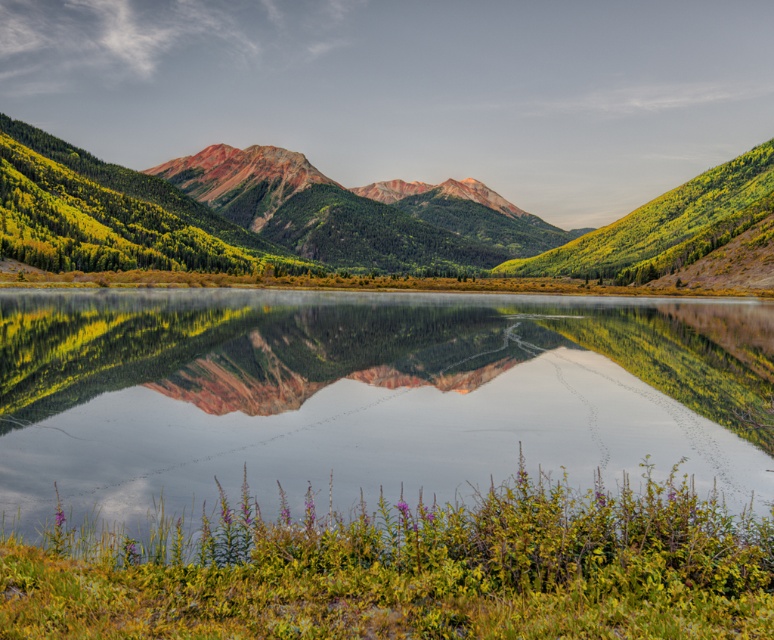
Question: Among these objects, which one is nearest to the camera?

Choices:
 (A) green grassy shore at lower center
 (B) matte red rock mountain range at center

Answer: (A)

Question: Does green grassy shore at lower center appear on the right side of matte red rock mountain range at center?

Choices:
 (A) yes
 (B) no

Answer: (B)

Question: Which point appears farthest from the camera in this image?

Choices:
 (A) (173, 259)
 (B) (165, 403)

Answer: (A)

Question: Which object appears farthest from the camera in this image?

Choices:
 (A) matte red rock mountain range at center
 (B) green grassy shore at lower center

Answer: (A)

Question: Does green grassy shore at lower center come in front of matte red rock mountain range at center?

Choices:
 (A) yes
 (B) no

Answer: (A)

Question: Is green grassy shore at lower center behind matte red rock mountain range at center?

Choices:
 (A) no
 (B) yes

Answer: (A)